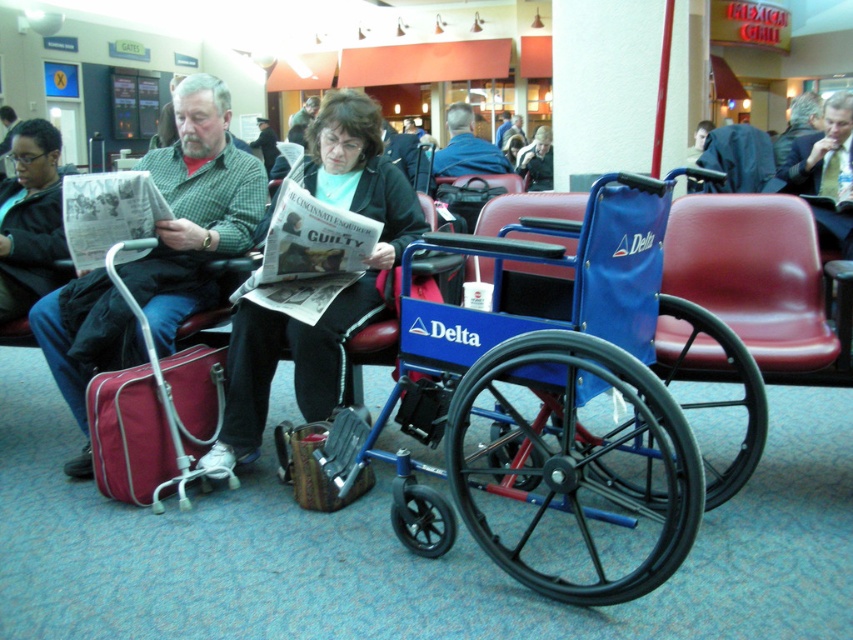
Question: Is red leather chair at center positioned behind light brown leather jacket at center?

Choices:
 (A) yes
 (B) no

Answer: (B)

Question: Among these objects, which one is nearest to the camera?

Choices:
 (A) blue fabric jacket at center
 (B) matte black jacket at center
 (C) maroon fabric suitcase at left
 (D) blue plastic wheelchair at center

Answer: (D)

Question: Based on their relative distances, which object is farther from the red leather chair at center?

Choices:
 (A) matte black jacket at center
 (B) matte green shirt at center
 (C) blue fabric jacket at center

Answer: (C)

Question: Is blue plastic wheelchair at center closer to camera compared to matte black hair at center?

Choices:
 (A) no
 (B) yes

Answer: (B)

Question: Is blue plastic wheelchair at center in front of matte black jacket at center?

Choices:
 (A) yes
 (B) no

Answer: (A)

Question: Which point appears closest to the camera in this image?

Choices:
 (A) (53, 305)
 (B) (492, 474)
 (C) (170, 481)
 (D) (276, 148)

Answer: (C)